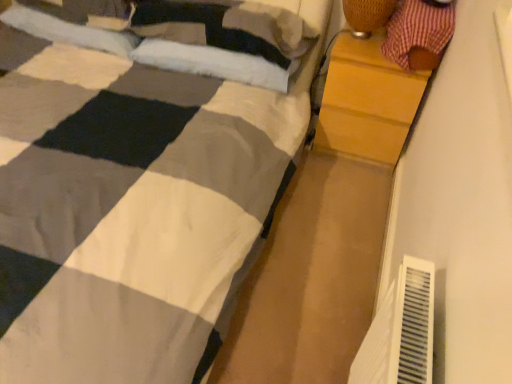
Question: Can you confirm if soft white pillow at upper left, which is counted as the 2th pillow, starting from the right, is smaller than woven bamboo lampshade at upper right?

Choices:
 (A) yes
 (B) no

Answer: (B)

Question: Does soft white pillow at upper left, positioned as the second pillow in left-to-right order, have a larger size compared to woven bamboo lampshade at upper right?

Choices:
 (A) no
 (B) yes

Answer: (B)

Question: Can you confirm if soft white pillow at upper left, which is counted as the 2th pillow, starting from the right, is thinner than woven bamboo lampshade at upper right?

Choices:
 (A) yes
 (B) no

Answer: (B)

Question: Considering the relative sizes of soft white pillow at upper left, positioned as the second pillow in left-to-right order, and woven bamboo lampshade at upper right in the image provided, is soft white pillow at upper left, positioned as the second pillow in left-to-right order, wider than woven bamboo lampshade at upper right?

Choices:
 (A) no
 (B) yes

Answer: (B)

Question: Does soft white pillow at upper left, positioned as the second pillow in left-to-right order, come behind woven bamboo lampshade at upper right?

Choices:
 (A) yes
 (B) no

Answer: (A)

Question: In terms of width, does soft white pillow at upper left, positioned as the 3th pillow in right-to-left order, look wider or thinner when compared to wooden chest of drawers at right?

Choices:
 (A) wide
 (B) thin

Answer: (B)

Question: Is soft white pillow at upper left, the first pillow in the left-to-right sequence, spatially inside wooden chest of drawers at right, or outside of it?

Choices:
 (A) outside
 (B) inside

Answer: (A)

Question: Based on their sizes in the image, would you say soft white pillow at upper left, positioned as the 3th pillow in right-to-left order, is bigger or smaller than wooden chest of drawers at right?

Choices:
 (A) big
 (B) small

Answer: (B)

Question: Is soft white pillow at upper left, positioned as the 3th pillow in right-to-left order, taller or shorter than wooden chest of drawers at right?

Choices:
 (A) short
 (B) tall

Answer: (A)

Question: Based on their positions, is soft white pillow at upper left, positioned as the second pillow in left-to-right order, located to the left or right of white soft pillow at upper center, which is counted as the first pillow, starting from the right?

Choices:
 (A) left
 (B) right

Answer: (A)

Question: Relative to white soft pillow at upper center, which ranks as the third pillow in left-to-right order, is soft white pillow at upper left, positioned as the second pillow in left-to-right order, in front or behind?

Choices:
 (A) behind
 (B) front

Answer: (A)

Question: Considering the positions of point (110, 23) and point (141, 57), is point (110, 23) closer or farther from the camera than point (141, 57)?

Choices:
 (A) closer
 (B) farther

Answer: (B)

Question: In terms of height, does soft white pillow at upper left, positioned as the second pillow in left-to-right order, look taller or shorter compared to white soft pillow at upper center, which ranks as the third pillow in left-to-right order?

Choices:
 (A) tall
 (B) short

Answer: (A)

Question: Would you say white soft pillow at upper center, which ranks as the third pillow in left-to-right order, is to the left or to the right of red plaid fabric at upper right in the picture?

Choices:
 (A) right
 (B) left

Answer: (B)

Question: Is white soft pillow at upper center, which ranks as the third pillow in left-to-right order, taller or shorter than red plaid fabric at upper right?

Choices:
 (A) short
 (B) tall

Answer: (A)